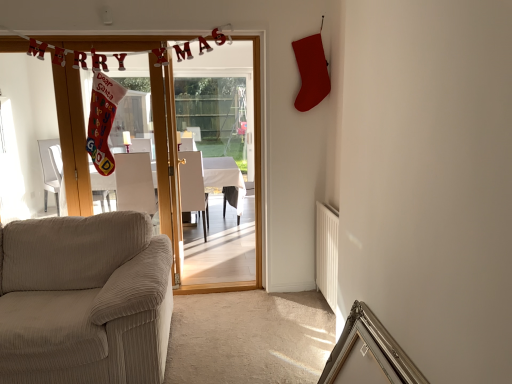
Question: Considering their positions, is wooden door at center located in front of or behind white glossy table at center?

Choices:
 (A) behind
 (B) front

Answer: (B)

Question: Does point (167, 127) appear closer or farther from the camera than point (238, 193)?

Choices:
 (A) farther
 (B) closer

Answer: (B)

Question: Which object is the closest to the beige corduroy couch at lower left?

Choices:
 (A) white corduroy armchair at center, acting as the 2th armchair starting from the right
 (B) silver metallic picture frame at lower right
 (C) white glossy table at center
 (D) wooden door at center
 (E) white fabric armchair at center, which is the second armchair in left-to-right order

Answer: (D)

Question: Based on their relative distances, which object is farther from the white fabric armchair at center, which is the second armchair in left-to-right order?

Choices:
 (A) silver metallic picture frame at lower right
 (B) white corduroy armchair at center, which is counted as the 1th armchair, starting from the left
 (C) wooden door at center
 (D) white glossy table at center
 (E) beige corduroy couch at lower left

Answer: (A)